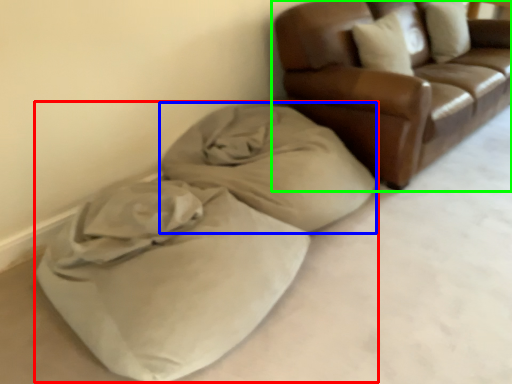
Question: Which object is the closest to the bean bag chair (highlighted by a red box)? Choose among these: blanket (highlighted by a blue box) or studio couch (highlighted by a green box).

Choices:
 (A) blanket
 (B) studio couch

Answer: (A)